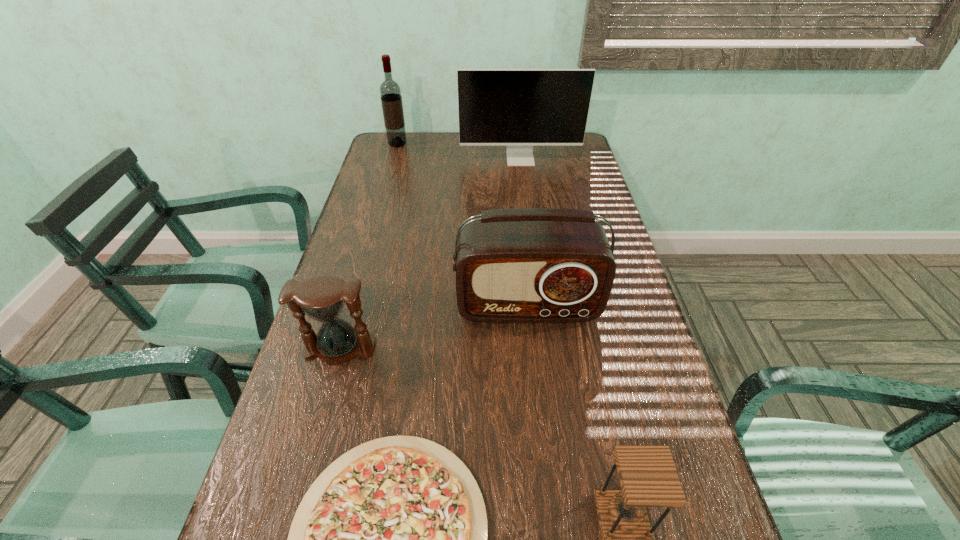
The height and width of the screenshot is (540, 960). I want to click on the farthest object, so click(x=390, y=92).

Where is `the fifth nearest object`? the fifth nearest object is located at coordinates (519, 108).

Where is `the fourth nearest object`? the fourth nearest object is located at coordinates (523, 265).

Locate an element on the screen. Image resolution: width=960 pixels, height=540 pixels. the left hourglass is located at coordinates (322, 298).

Find the location of a particular element. the fourth farthest object is located at coordinates (322, 298).

Find the location of `free spot located 0.330m on the right of the wine bottle`. free spot located 0.330m on the right of the wine bottle is located at coordinates (492, 144).

What are the coordinates of `vacant space located on the front-facing side of the monitor` in the screenshot? It's located at (523, 181).

You are a GUI agent. You are given a task and a screenshot of the screen. Output one action in this format:
    pyautogui.click(x=<x>, y=<y>)
    Task: Click on the vacant position located on the front panel of the radio receiver
    
    Given the screenshot: What is the action you would take?
    pyautogui.click(x=540, y=417)

Where is `free spot located 0.200m on the back of the farther hourglass`? This screenshot has width=960, height=540. free spot located 0.200m on the back of the farther hourglass is located at coordinates (361, 273).

Where is `wine bottle that is at the far edge`? wine bottle that is at the far edge is located at coordinates (390, 92).